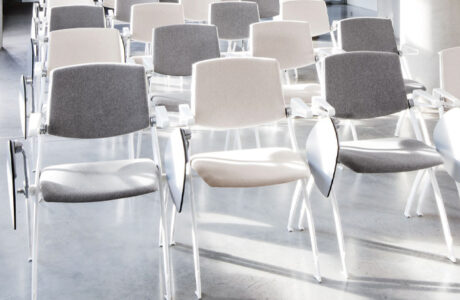
I want to click on white coloured chairs, so click(224, 92), click(273, 42), click(311, 13), click(445, 69), click(164, 20), click(193, 10), click(87, 37), click(110, 6).